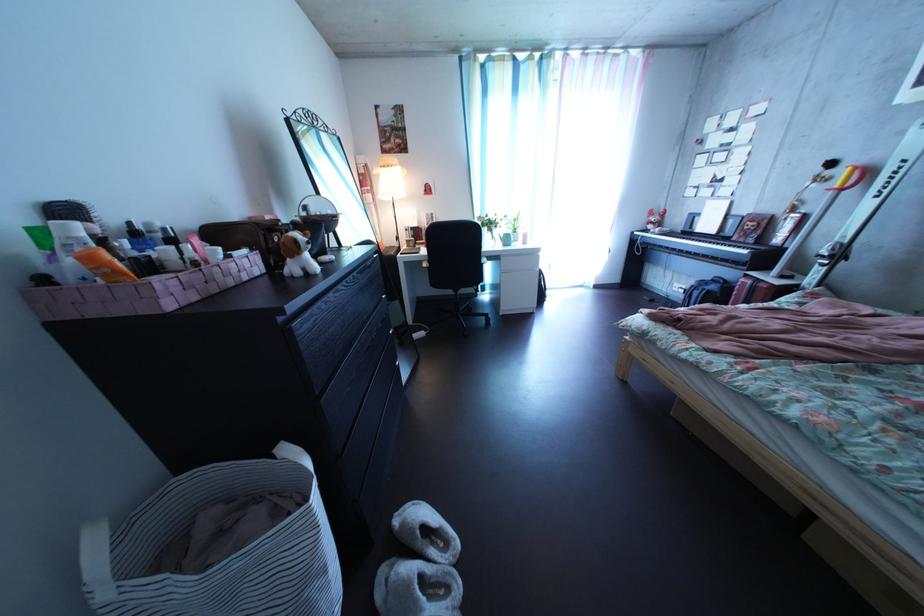
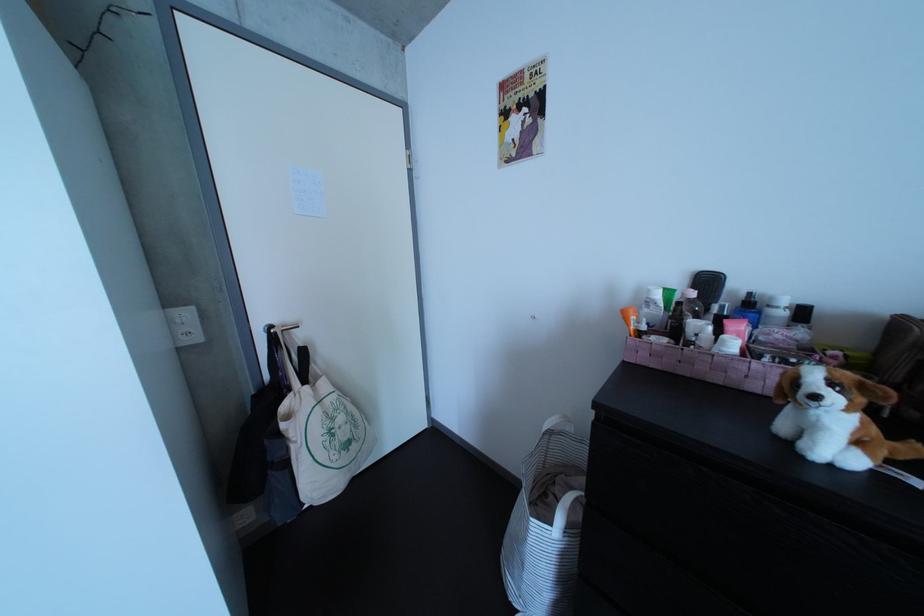
The point at (310, 249) is marked in the first image. Where is the corresponding point in the second image?

(809, 389)